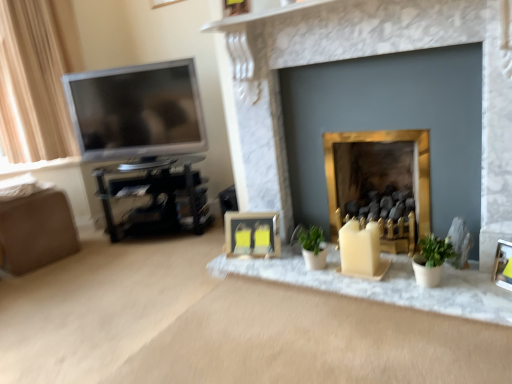
Question: From the image's perspective, is matte black picture frame at center, which is the 2th picture frame from right to left, located above matte yellow candle at center, which is the 2th candle in front-to-back order?

Choices:
 (A) no
 (B) yes

Answer: (B)

Question: Could you tell me if matte black picture frame at center, the 1th picture frame from the back, is turned towards matte yellow candle at center, which is the 2th candle in front-to-back order?

Choices:
 (A) yes
 (B) no

Answer: (A)

Question: From a real-world perspective, is matte black picture frame at center, placed as the 2th picture frame when sorted from front to back, located beneath matte yellow candle at center, which is the 2th candle in front-to-back order?

Choices:
 (A) no
 (B) yes

Answer: (A)

Question: Can you confirm if matte black picture frame at center, acting as the 1th picture frame starting from the left, is positioned to the left of matte yellow candle at center, which is the 2th candle in front-to-back order?

Choices:
 (A) no
 (B) yes

Answer: (B)

Question: From a real-world perspective, is matte black picture frame at center, acting as the 1th picture frame starting from the left, on matte yellow candle at center, which is the 2th candle in right-to-left order?

Choices:
 (A) yes
 (B) no

Answer: (A)

Question: Is matte black picture frame at center, placed as the 2th picture frame when sorted from front to back, taller than matte yellow candle at center, which is the 2th candle in right-to-left order?

Choices:
 (A) yes
 (B) no

Answer: (A)

Question: From the image's perspective, would you say matte black picture frame at center, placed as the 2th picture frame when sorted from front to back, is shown under beige matte candle at center, the 1th candle in the front-to-back sequence?

Choices:
 (A) no
 (B) yes

Answer: (A)

Question: Is matte black picture frame at center, acting as the 1th picture frame starting from the left, taller than beige matte candle at center, arranged as the 2th candle when viewed from the left?

Choices:
 (A) yes
 (B) no

Answer: (A)

Question: Considering the relative sizes of matte black picture frame at center, placed as the 2th picture frame when sorted from front to back, and beige matte candle at center, arranged as the 2th candle when viewed from the left, in the image provided, is matte black picture frame at center, placed as the 2th picture frame when sorted from front to back, bigger than beige matte candle at center, arranged as the 2th candle when viewed from the left,?

Choices:
 (A) no
 (B) yes

Answer: (B)

Question: Could you tell me if matte black picture frame at center, acting as the 1th picture frame starting from the left, is facing beige matte candle at center, the 1th candle in the front-to-back sequence?

Choices:
 (A) yes
 (B) no

Answer: (B)

Question: Considering the relative sizes of matte black picture frame at center, the 1th picture frame from the back, and beige matte candle at center, the 1th candle positioned from the right, in the image provided, is matte black picture frame at center, the 1th picture frame from the back, thinner than beige matte candle at center, the 1th candle positioned from the right,?

Choices:
 (A) no
 (B) yes

Answer: (B)

Question: From a real-world perspective, is matte black picture frame at center, placed as the 2th picture frame when sorted from front to back, below beige matte candle at center, which ranks as the 2th candle in back-to-front order?

Choices:
 (A) yes
 (B) no

Answer: (A)

Question: Can you confirm if metallic gold picture frame at lower right, arranged as the 2th picture frame when viewed from the back, is positioned to the right of marble fireplace at center, the first fireplace from the left?

Choices:
 (A) no
 (B) yes

Answer: (B)